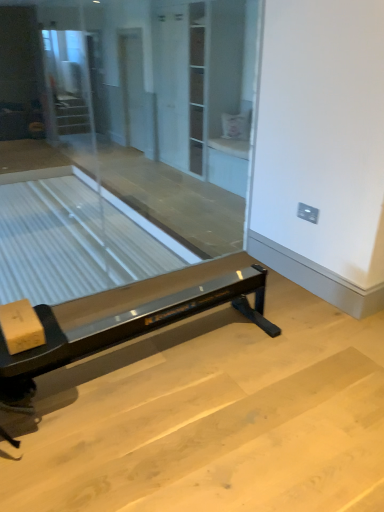
Question: From the image's perspective, would you say transparent glass screen door at center is positioned over black glossy rowing machine at center?

Choices:
 (A) no
 (B) yes

Answer: (B)

Question: Are transparent glass screen door at center and black glossy rowing machine at center making contact?

Choices:
 (A) yes
 (B) no

Answer: (B)

Question: Is transparent glass screen door at center thinner than black glossy rowing machine at center?

Choices:
 (A) no
 (B) yes

Answer: (B)

Question: Can you confirm if transparent glass screen door at center is smaller than black glossy rowing machine at center?

Choices:
 (A) no
 (B) yes

Answer: (A)

Question: Would you say transparent glass screen door at center is a long distance from black glossy rowing machine at center?

Choices:
 (A) no
 (B) yes

Answer: (B)

Question: In terms of width, does transparent glass screen door at center look wider or thinner when compared to clear glass table at left?

Choices:
 (A) thin
 (B) wide

Answer: (A)

Question: Is point (129, 80) positioned closer to the camera than point (190, 263)?

Choices:
 (A) farther
 (B) closer

Answer: (A)

Question: Visually, is transparent glass screen door at center positioned to the left or to the right of clear glass table at left?

Choices:
 (A) right
 (B) left

Answer: (A)

Question: Based on their sizes in the image, would you say transparent glass screen door at center is bigger or smaller than clear glass table at left?

Choices:
 (A) small
 (B) big

Answer: (A)

Question: Does point (49, 359) appear closer or farther from the camera than point (1, 199)?

Choices:
 (A) farther
 (B) closer

Answer: (B)

Question: Visually, is black glossy rowing machine at center positioned to the left or to the right of clear glass table at left?

Choices:
 (A) left
 (B) right

Answer: (B)

Question: From a real-world perspective, is black glossy rowing machine at center physically located above or below clear glass table at left?

Choices:
 (A) above
 (B) below

Answer: (A)

Question: Looking at their shapes, would you say black glossy rowing machine at center is wider or thinner than clear glass table at left?

Choices:
 (A) wide
 (B) thin

Answer: (B)

Question: In terms of size, does clear glass table at left appear bigger or smaller than transparent glass screen door at center?

Choices:
 (A) small
 (B) big

Answer: (B)

Question: Is clear glass table at left taller or shorter than transparent glass screen door at center?

Choices:
 (A) short
 (B) tall

Answer: (A)